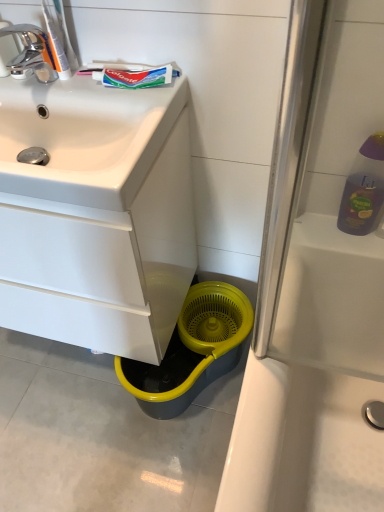
Question: Is chrome/metallic faucet at upper left at the right side of white glossy cabinet at lower left?

Choices:
 (A) no
 (B) yes

Answer: (A)

Question: Is chrome/metallic faucet at upper left facing towards white glossy cabinet at lower left?

Choices:
 (A) no
 (B) yes

Answer: (A)

Question: Is chrome/metallic faucet at upper left looking in the opposite direction of white glossy cabinet at lower left?

Choices:
 (A) yes
 (B) no

Answer: (B)

Question: Is chrome/metallic faucet at upper left positioned far away from white glossy cabinet at lower left?

Choices:
 (A) yes
 (B) no

Answer: (B)

Question: Can you confirm if chrome/metallic faucet at upper left is shorter than white glossy cabinet at lower left?

Choices:
 (A) yes
 (B) no

Answer: (A)

Question: Is white glossy sink at upper left situated inside white glossy cabinet at lower left or outside?

Choices:
 (A) outside
 (B) inside

Answer: (B)

Question: Based on their sizes in the image, would you say white glossy sink at upper left is bigger or smaller than white glossy cabinet at lower left?

Choices:
 (A) small
 (B) big

Answer: (A)

Question: In terms of height, does white glossy sink at upper left look taller or shorter compared to white glossy cabinet at lower left?

Choices:
 (A) tall
 (B) short

Answer: (B)

Question: Would you say white glossy sink at upper left is to the left or to the right of white glossy cabinet at lower left in the picture?

Choices:
 (A) right
 (B) left

Answer: (A)

Question: From a real-world perspective, relative to white glossy sink at upper left, is white glossy cabinet at lower left vertically above or below?

Choices:
 (A) above
 (B) below

Answer: (B)

Question: Is white glossy cabinet at lower left situated inside white glossy sink at upper left or outside?

Choices:
 (A) inside
 (B) outside

Answer: (B)

Question: Is white glossy cabinet at lower left taller or shorter than white glossy sink at upper left?

Choices:
 (A) tall
 (B) short

Answer: (A)

Question: From the image's perspective, relative to white glossy sink at upper left, is white glossy cabinet at lower left above or below?

Choices:
 (A) above
 (B) below

Answer: (B)

Question: Is chrome/metallic faucet at upper left bigger or smaller than colgate toothpaste at upper left, arranged as the second toothpaste when viewed from the left?

Choices:
 (A) small
 (B) big

Answer: (B)

Question: Does point pyautogui.click(x=26, y=54) appear closer or farther from the camera than point pyautogui.click(x=142, y=73)?

Choices:
 (A) farther
 (B) closer

Answer: (A)